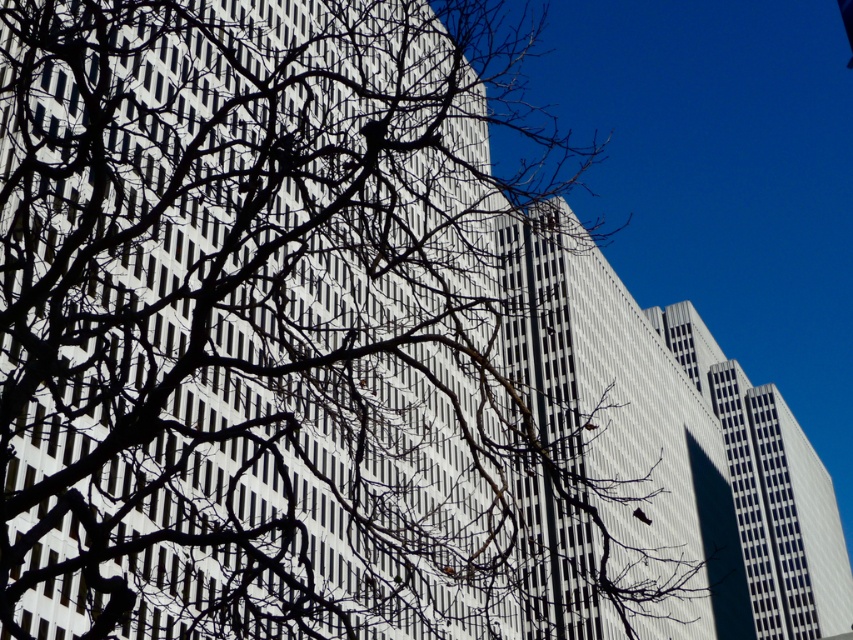
Is white smooth building at center to the left of white glass building at center from the viewer's perspective?

Correct, you'll find white smooth building at center to the left of white glass building at center.

Can you confirm if white smooth building at center is positioned below white glass building at center?

No, white smooth building at center is not below white glass building at center.

The image size is (853, 640). In order to click on white smooth building at center in this screenshot , I will do `click(610, 451)`.